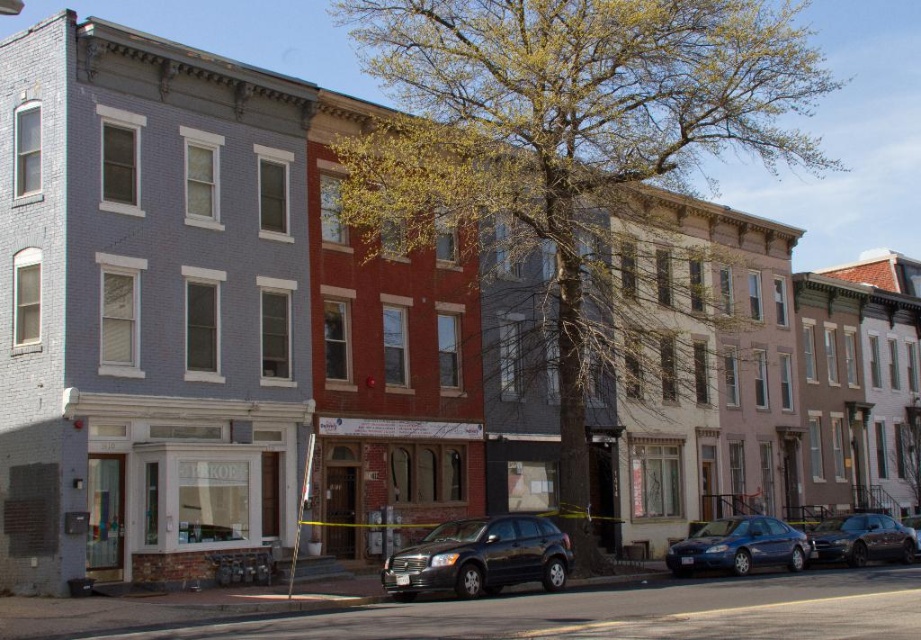
Question: Which point is farther to the camera?

Choices:
 (A) (895, 522)
 (B) (420, 586)
 (C) (745, 540)

Answer: (A)

Question: Estimate the real-world distances between objects in this image. Which object is closer to the matte black suv at center?

Choices:
 (A) shiny black sedan at lower right
 (B) metallic blue sedan at lower right
 (C) green leafy tree at center

Answer: (B)

Question: In this image, where is matte black suv at center located relative to shiny black sedan at lower right?

Choices:
 (A) below
 (B) above

Answer: (B)

Question: Does matte black suv at center lie behind shiny black sedan at lower right?

Choices:
 (A) no
 (B) yes

Answer: (A)

Question: Which point is farther from the camera taking this photo?

Choices:
 (A) (772, 529)
 (B) (831, 541)
 (C) (434, 556)
 (D) (379, 48)

Answer: (D)

Question: Can you confirm if metallic blue sedan at lower right is smaller than shiny black sedan at lower right?

Choices:
 (A) no
 (B) yes

Answer: (B)